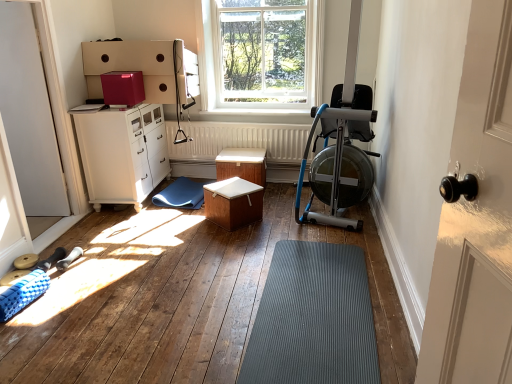
Question: Considering the relative positions of clear glass window at upper center and blue metallic rowing machine at right in the image provided, is clear glass window at upper center in front of blue metallic rowing machine at right?

Choices:
 (A) no
 (B) yes

Answer: (A)

Question: Considering the relative sizes of clear glass window at upper center and blue metallic rowing machine at right in the image provided, is clear glass window at upper center bigger than blue metallic rowing machine at right?

Choices:
 (A) yes
 (B) no

Answer: (B)

Question: From a real-world perspective, is clear glass window at upper center located higher than blue metallic rowing machine at right?

Choices:
 (A) no
 (B) yes

Answer: (B)

Question: Is clear glass window at upper center completely or partially outside of blue metallic rowing machine at right?

Choices:
 (A) no
 (B) yes

Answer: (B)

Question: Is clear glass window at upper center facing away from blue metallic rowing machine at right?

Choices:
 (A) no
 (B) yes

Answer: (A)

Question: Is point (185, 144) closer or farther from the camera than point (181, 178)?

Choices:
 (A) closer
 (B) farther

Answer: (A)

Question: From the image's perspective, relative to blue rubber mat at lower left, is white matte radiator at center above or below?

Choices:
 (A) below
 (B) above

Answer: (B)

Question: From their relative heights in the image, would you say white matte radiator at center is taller or shorter than blue rubber mat at lower left?

Choices:
 (A) short
 (B) tall

Answer: (B)

Question: Considering the positions of white matte radiator at center and blue rubber mat at lower left in the image, is white matte radiator at center wider or thinner than blue rubber mat at lower left?

Choices:
 (A) thin
 (B) wide

Answer: (A)

Question: From the image's perspective, is wooden table at center, which ranks as the first table in back-to-front order, located above or below blue metallic rowing machine at right?

Choices:
 (A) below
 (B) above

Answer: (A)

Question: Do you think wooden table at center, which ranks as the first table in back-to-front order, is within blue metallic rowing machine at right, or outside of it?

Choices:
 (A) inside
 (B) outside

Answer: (B)

Question: Is wooden table at center, acting as the second table starting from the front, taller or shorter than blue metallic rowing machine at right?

Choices:
 (A) tall
 (B) short

Answer: (B)

Question: Considering their positions, is wooden table at center, which ranks as the first table in back-to-front order, located in front of or behind blue metallic rowing machine at right?

Choices:
 (A) behind
 (B) front

Answer: (A)

Question: From a real-world perspective, is white matte radiator at center above or below blue metallic rowing machine at right?

Choices:
 (A) below
 (B) above

Answer: (A)

Question: Is point (293, 129) closer or farther from the camera than point (309, 178)?

Choices:
 (A) closer
 (B) farther

Answer: (B)